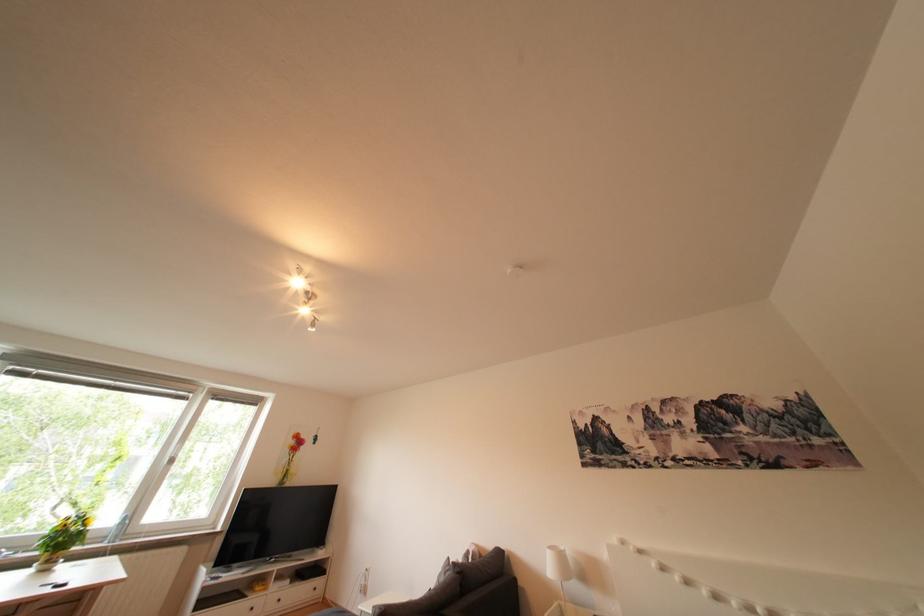
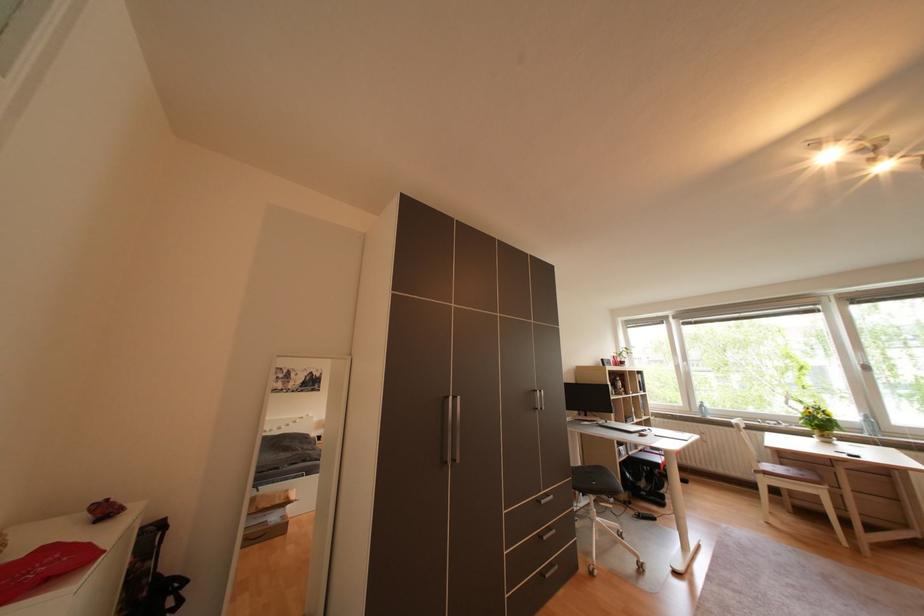
How did the camera likely rotate?

The rotation direction of the camera is left-up.